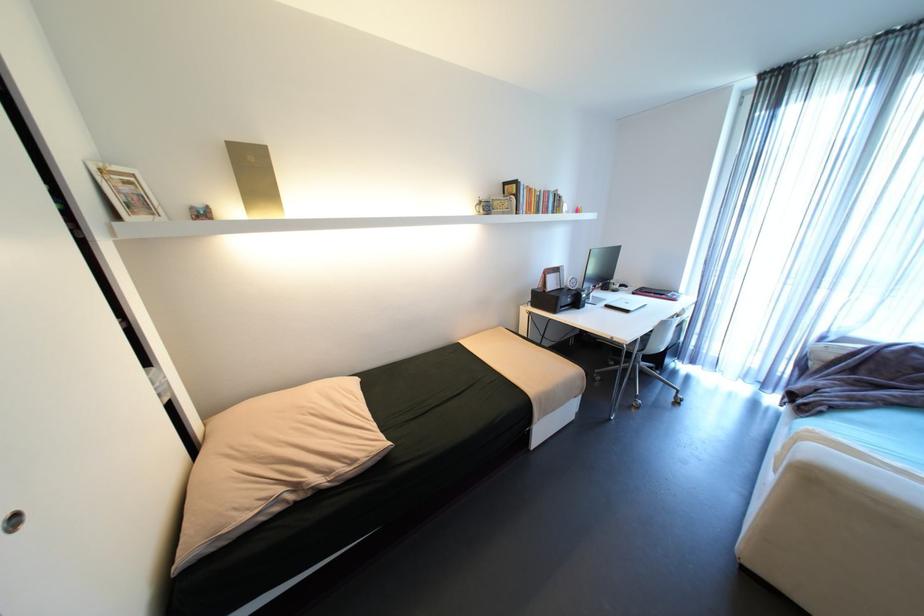
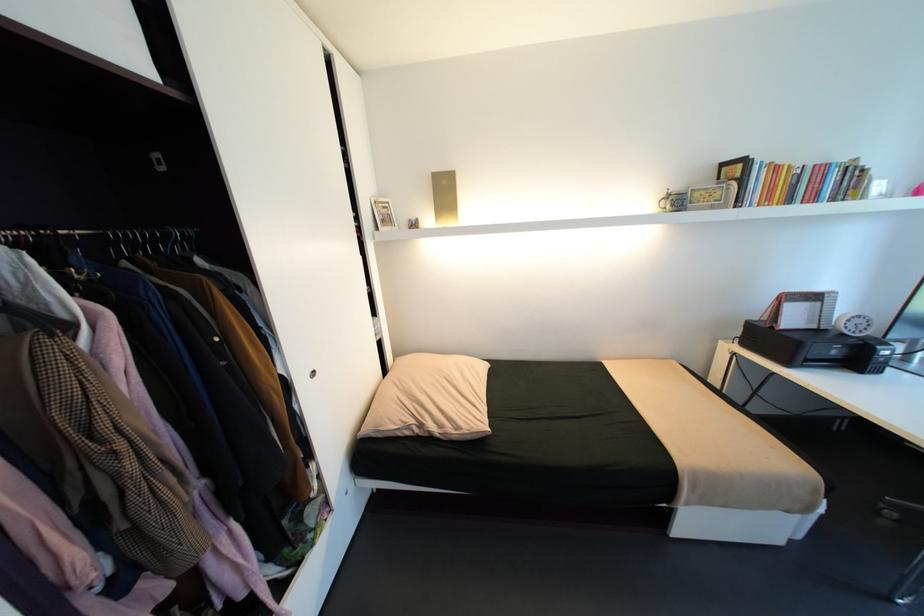
Where in the second image is the point corresponding to the point at 488,200 from the first image?

(676, 192)